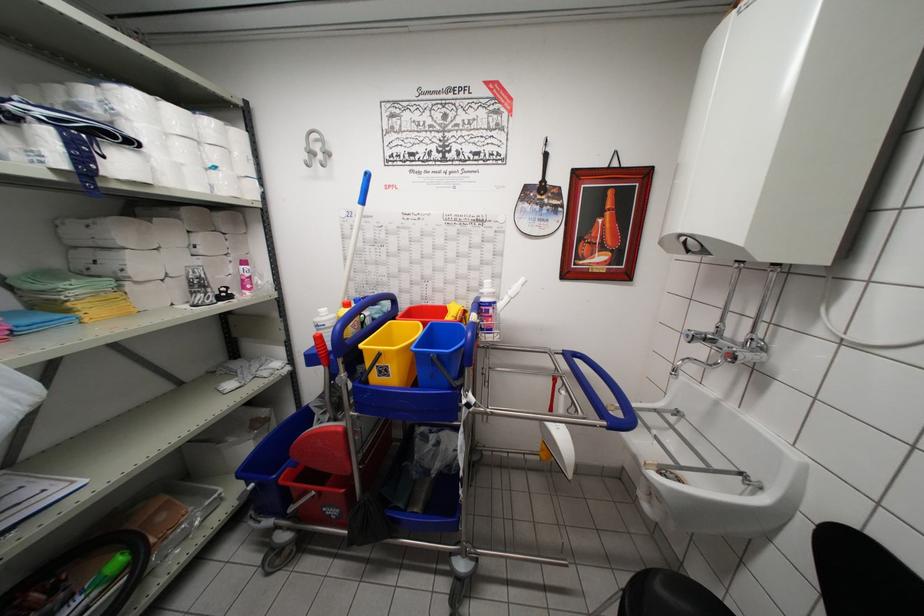
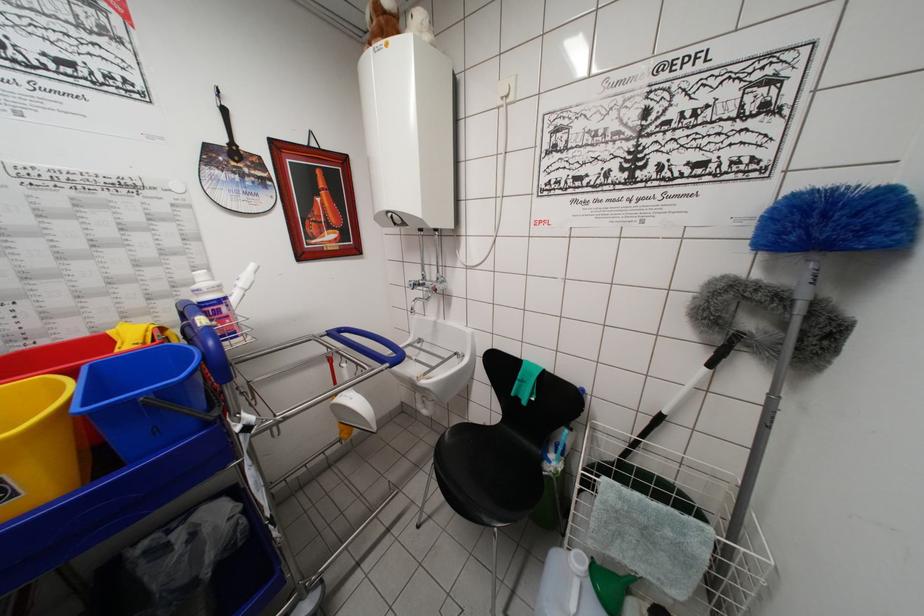
The point at (468,315) is marked in the first image. Where is the corresponding point in the second image?

(165, 333)